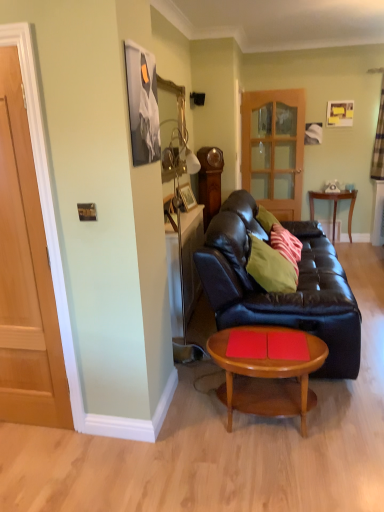
Image resolution: width=384 pixels, height=512 pixels. Identify the location of white sheer curtain at upper right. (378, 137).

This screenshot has width=384, height=512. Identify the location of green matte pillow at center, the 1th pillow from the front. (271, 267).

In order to face green matte pillow at center, which is counted as the 1th pillow, starting from the back, should I rotate leftwards or rightwards?

It's best to rotate right around 12.338 degrees.

Image resolution: width=384 pixels, height=512 pixels. What do you see at coordinates (286, 245) in the screenshot?
I see `green matte pillow at center, which ranks as the second pillow in front-to-back order` at bounding box center [286, 245].

Locate an element on the screen. light brown wooden coffee table at center is located at coordinates (267, 370).

Where is `matte black leather couch at center`? This screenshot has width=384, height=512. matte black leather couch at center is located at coordinates (279, 293).

Is green matte pillow at center, the second pillow positioned from the back, inside or outside of white sheer curtain at upper right?

green matte pillow at center, the second pillow positioned from the back, cannot be found inside white sheer curtain at upper right.

From the image's perspective, does green matte pillow at center, the second pillow positioned from the back, appear higher than white sheer curtain at upper right?

No, from the image's perspective, green matte pillow at center, the second pillow positioned from the back, is not above white sheer curtain at upper right.

Is the surface of green matte pillow at center, the second pillow positioned from the back, in direct contact with white sheer curtain at upper right?

green matte pillow at center, the second pillow positioned from the back, and white sheer curtain at upper right are clearly separated.

From a real-world perspective, who is located lower, green matte pillow at center, the second pillow positioned from the back, or white sheer curtain at upper right?

In real-world perspective, green matte pillow at center, the second pillow positioned from the back, is lower.

Which of these two, white sheer curtain at upper right or green matte pillow at center, which is counted as the 1th pillow, starting from the back, is wider?

With larger width is green matte pillow at center, which is counted as the 1th pillow, starting from the back.

Is white sheer curtain at upper right spatially inside green matte pillow at center, which ranks as the second pillow in front-to-back order, or outside of it?

Answer: white sheer curtain at upper right is spatially situated outside green matte pillow at center, which ranks as the second pillow in front-to-back order.

Are white sheer curtain at upper right and green matte pillow at center, which ranks as the second pillow in front-to-back order, far apart?

Indeed, white sheer curtain at upper right is not near green matte pillow at center, which ranks as the second pillow in front-to-back order.

Which pillow is the 1st one when counting from the front of the white sheer curtain at upper right? Please provide its 2D coordinates.

[(286, 245)]

Is there a large distance between matte black leather couch at center and green matte pillow at center, which is counted as the 1th pillow, starting from the back?

matte black leather couch at center is actually quite close to green matte pillow at center, which is counted as the 1th pillow, starting from the back.

Which of these two, matte black leather couch at center or green matte pillow at center, which ranks as the second pillow in front-to-back order, is bigger?

matte black leather couch at center is bigger.

From the image's perspective, who appears lower, matte black leather couch at center or green matte pillow at center, which is counted as the 1th pillow, starting from the back?

matte black leather couch at center is shown below in the image.

Which object is further away from the camera, matte black leather couch at center or green matte pillow at center, which ranks as the second pillow in front-to-back order?

green matte pillow at center, which ranks as the second pillow in front-to-back order, is further from the camera.

Is green matte pillow at center, the second pillow positioned from the back, at the back of matte black leather couch at center?

Yes, matte black leather couch at center is positioned with its back facing green matte pillow at center, the second pillow positioned from the back.

Which object is positioned more to the right, matte black leather couch at center or green matte pillow at center, the 1th pillow from the front?

matte black leather couch at center.

Is matte black leather couch at center far from green matte pillow at center, the 1th pillow from the front?

No, matte black leather couch at center is not far away from green matte pillow at center, the 1th pillow from the front.

Is translucent wooden door at center positioned with its back to green matte pillow at center, which ranks as the second pillow in front-to-back order?

No, translucent wooden door at center's orientation is not away from green matte pillow at center, which ranks as the second pillow in front-to-back order.

From a real-world perspective, is translucent wooden door at center physically below green matte pillow at center, which is counted as the 1th pillow, starting from the back?

Actually, translucent wooden door at center is physically above green matte pillow at center, which is counted as the 1th pillow, starting from the back, in the real world.

Considering the sizes of objects translucent wooden door at center and green matte pillow at center, which is counted as the 1th pillow, starting from the back, in the image provided, who is wider, translucent wooden door at center or green matte pillow at center, which is counted as the 1th pillow, starting from the back,?

With larger width is green matte pillow at center, which is counted as the 1th pillow, starting from the back.

How many degrees apart are the facing directions of translucent wooden door at center and green matte pillow at center, which is counted as the 1th pillow, starting from the back?

91.3 degrees.

Which object is further away from the camera, wooden side table at right or white sheer curtain at upper right?

wooden side table at right is further from the camera.

From the image's perspective, which object appears higher, wooden side table at right or white sheer curtain at upper right?

white sheer curtain at upper right.

Is there a large distance between wooden side table at right and white sheer curtain at upper right?

wooden side table at right is actually quite close to white sheer curtain at upper right.

Is point (266, 250) closer or farther from the camera than point (258, 402)?

Clearly, point (266, 250) is more distant from the camera than point (258, 402).

Is green matte pillow at center, the 1th pillow from the front, facing away from light brown wooden coffee table at center?

No.

You are a GUI agent. You are given a task and a screenshot of the screen. Output one action in this format:
    pyautogui.click(x=<x>, y=<y>)
    Task: Click on the coffee table below the green matte pillow at center, the 1th pillow from the front (from a real-world perspective)
    Image resolution: width=384 pixels, height=512 pixels.
    Given the screenshot: What is the action you would take?
    pyautogui.click(x=267, y=370)

Identify the location of curtain on the right of green matte pillow at center, the second pillow positioned from the back. (378, 137).

Where is `curtain behind the green matte pillow at center, which ranks as the second pillow in front-to-back order`? curtain behind the green matte pillow at center, which ranks as the second pillow in front-to-back order is located at coordinates (378, 137).

Consider the image. Based on their spatial positions, is green matte pillow at center, the second pillow positioned from the back, or white sheer curtain at upper right further from metallic silver picture frame at upper left?

white sheer curtain at upper right is further to metallic silver picture frame at upper left.

Which object lies nearer to the anchor point translucent wooden door at center, green matte pillow at center, the 1th pillow from the front, or green matte pillow at center, which is counted as the 1th pillow, starting from the back?

The object closer to translucent wooden door at center is green matte pillow at center, which is counted as the 1th pillow, starting from the back.

In the scene shown: From the image, which object appears to be nearer to wooden side table at right, matte black leather couch at center or wooden door at left?

matte black leather couch at center.

Estimate the real-world distances between objects in this image. Which object is closer to metallic silver picture frame at upper left, light brown wooden coffee table at center or wooden side table at right?

light brown wooden coffee table at center is closer to metallic silver picture frame at upper left.

Consider the image. Based on their spatial positions, is green matte pillow at center, which ranks as the second pillow in front-to-back order, or metallic silver picture frame at upper left further from wooden side table at right?

Based on the image, metallic silver picture frame at upper left appears to be further to wooden side table at right.

Which object lies further to the anchor point white sheer curtain at upper right, green matte pillow at center, which ranks as the second pillow in front-to-back order, or metallic silver picture frame at upper left?

metallic silver picture frame at upper left is further to white sheer curtain at upper right.

When comparing their distances from green matte pillow at center, the 1th pillow from the front, does light brown wooden coffee table at center or wooden side table at right seem closer?

Based on the image, light brown wooden coffee table at center appears to be nearer to green matte pillow at center, the 1th pillow from the front.

Considering their positions, is translucent wooden door at center positioned closer to white sheer curtain at upper right than wooden door at left?

Among the two, translucent wooden door at center is located nearer to white sheer curtain at upper right.

Where is `door positioned between metallic silver picture frame at upper left and white sheer curtain at upper right from near to far`? door positioned between metallic silver picture frame at upper left and white sheer curtain at upper right from near to far is located at coordinates (25, 275).

You are a GUI agent. You are given a task and a screenshot of the screen. Output one action in this format:
    pyautogui.click(x=<x>, y=<y>)
    Task: Click on the coffee table between wooden door at left and green matte pillow at center, which ranks as the second pillow in front-to-back order
    Image resolution: width=384 pixels, height=512 pixels.
    Given the screenshot: What is the action you would take?
    pyautogui.click(x=267, y=370)

This screenshot has height=512, width=384. Identify the location of coffee table between metallic silver picture frame at upper left and green matte pillow at center, which ranks as the second pillow in front-to-back order, along the z-axis. (267, 370).

The image size is (384, 512). What are the coordinates of `glass door between light brown wooden coffee table at center and wooden side table at right in the front-back direction` in the screenshot? It's located at (274, 149).